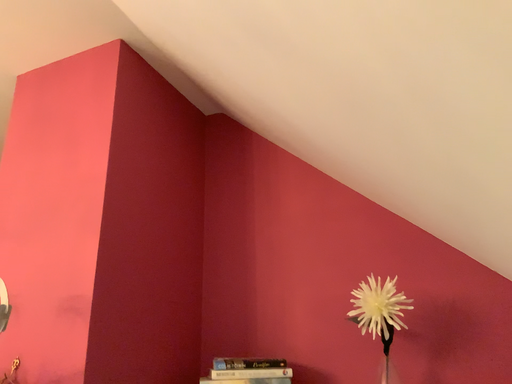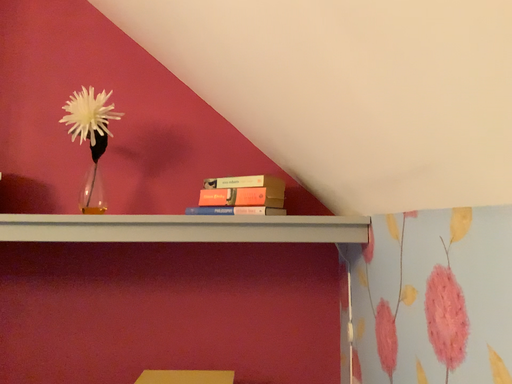
Question: Which way did the camera rotate in the video?

Choices:
 (A) rotated downward
 (B) rotated upward

Answer: (A)